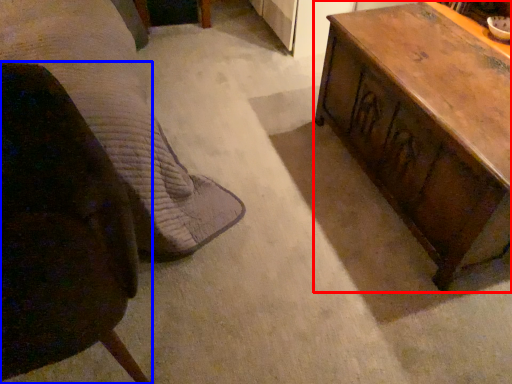
Question: Among these objects, which one is nearest to the camera, table (highlighted by a red box) or chair (highlighted by a blue box)?

Choices:
 (A) table
 (B) chair

Answer: (B)